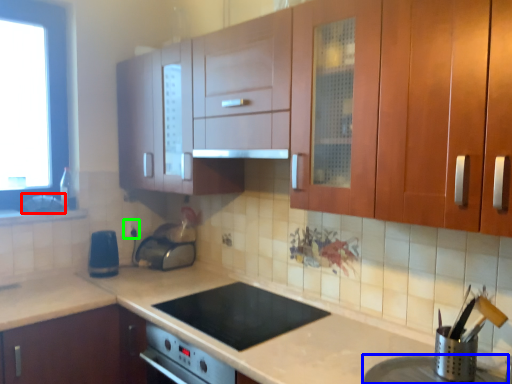
Question: Considering the real-world distances, which object is closest to sink (highlighted by a red box)? appliance (highlighted by a blue box) or electric outlet (highlighted by a green box).

Choices:
 (A) appliance
 (B) electric outlet

Answer: (B)